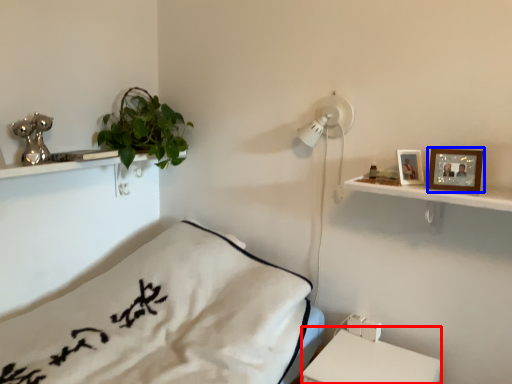
Question: Which point is closer to the camera, table (highlighted by a red box) or picture frame (highlighted by a blue box)?

Choices:
 (A) table
 (B) picture frame

Answer: (A)